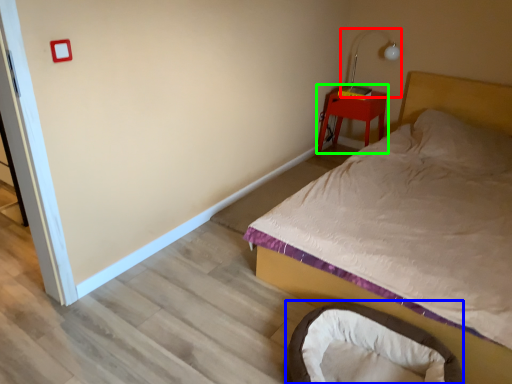
Question: Which is farther away from table lamp (highlighted by a red box)? infant bed (highlighted by a blue box) or nightstand (highlighted by a green box)?

Choices:
 (A) infant bed
 (B) nightstand

Answer: (A)